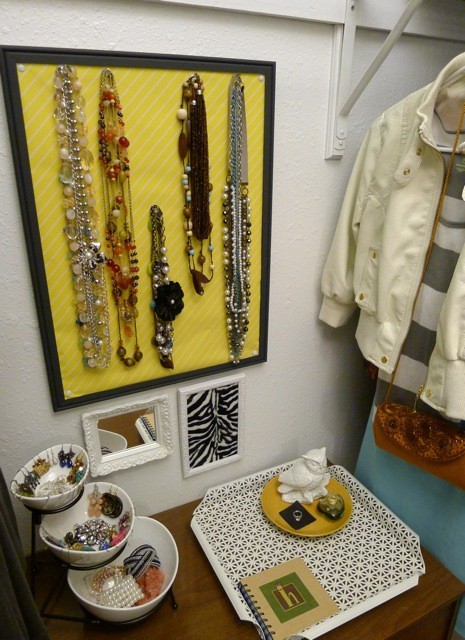
The height and width of the screenshot is (640, 465). I want to click on bulletin board, so click(147, 113).